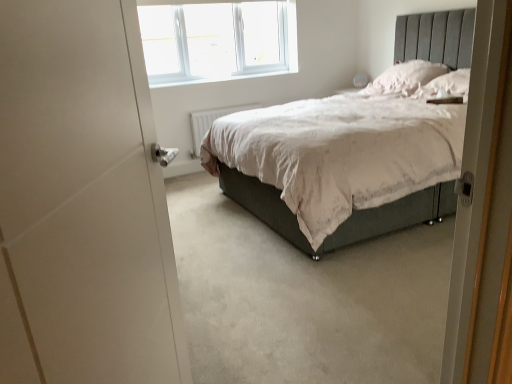
Image resolution: width=512 pixels, height=384 pixels. What are the coordinates of `free spot above white plastic radiator at center (from a real-world perspective)` in the screenshot? It's located at (225, 104).